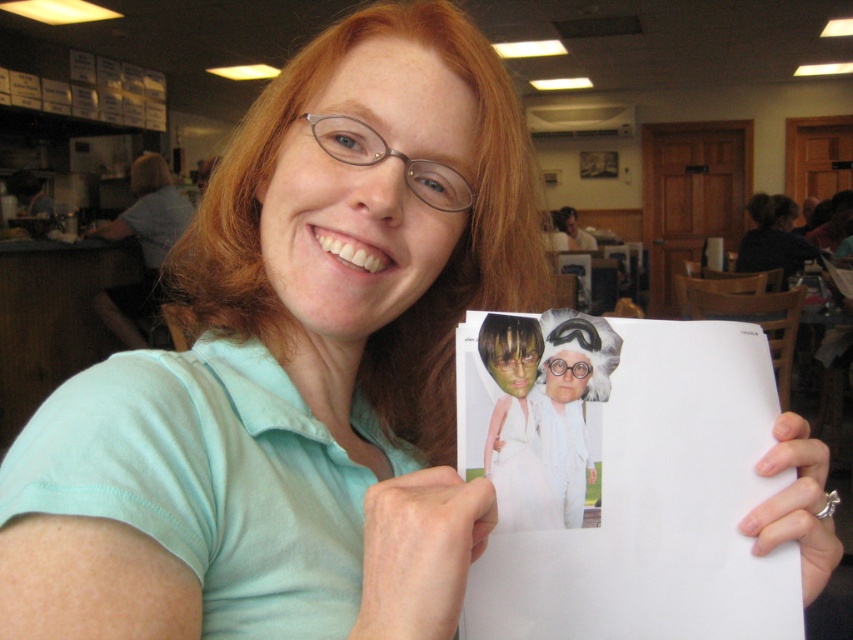
Based on the scene description, where is the matte white dress at center located in the image?

The matte white dress at center is located at point (515, 426) in the image.

You are a photographer trying to capture a clear shot of the matte white dress at center and the white paper at center. Which object should you focus on first to ensure both are in focus?

You should focus on the matte white dress at center first since it is closer to the viewer than the white paper at center, allowing for better depth of field coverage for both objects.

You are organizing a costume party and need to determine which item is bigger between the matte white dress at center and the white paper at center. Which one is larger?

The matte white dress at center is larger than the white paper at center according to the description.